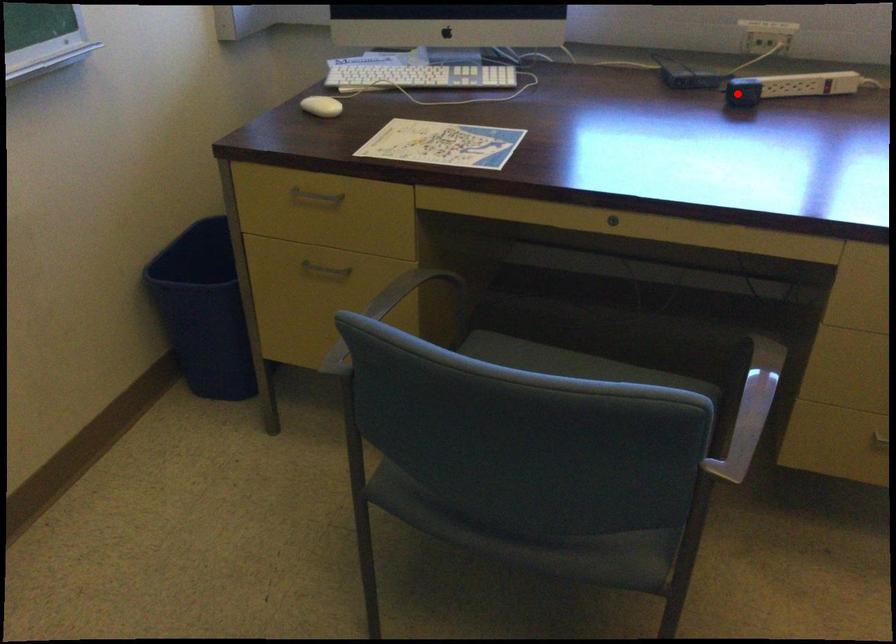
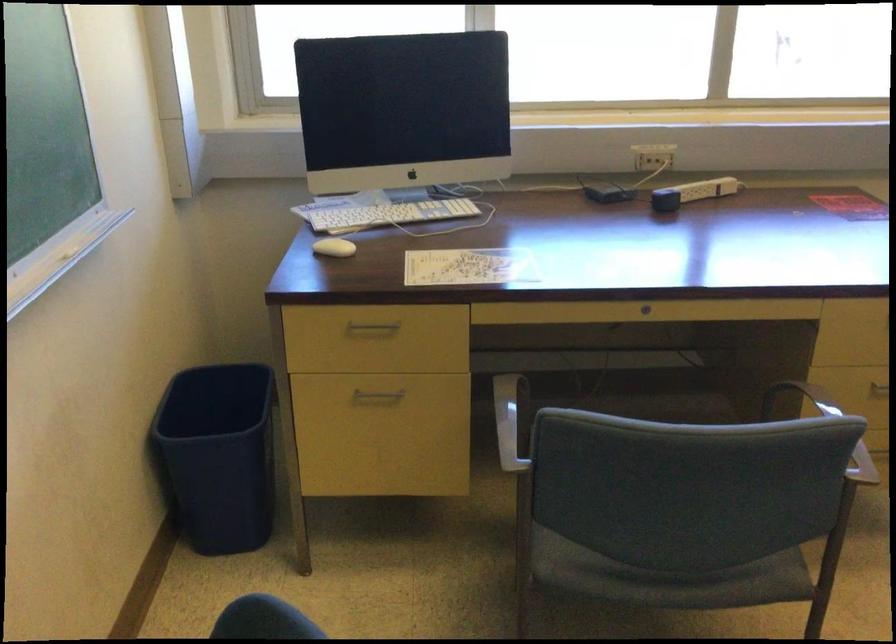
Find the pixel in the second image that matches the highlighted location in the first image.

(665, 200)